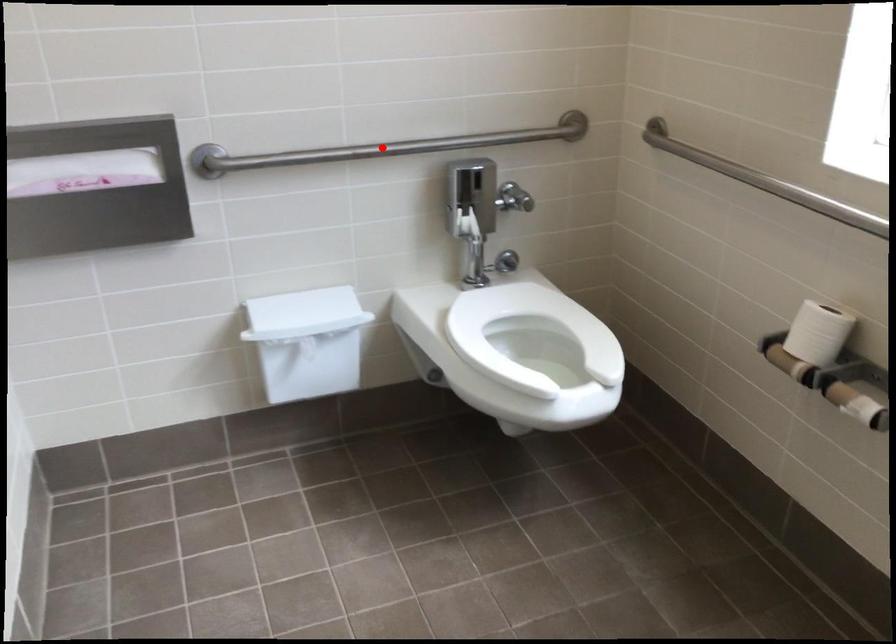
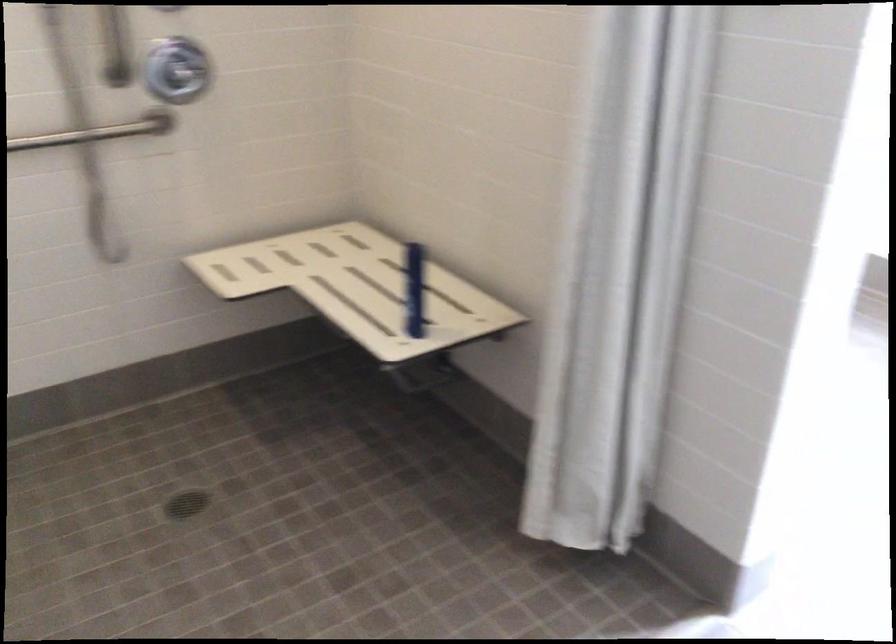
Question: I am providing you with two images of the same scene from different viewpoints. A red point is marked on the first image. Is the red point's position out of view in image 2?

Choices:
 (A) Yes
 (B) No

Answer: (A)